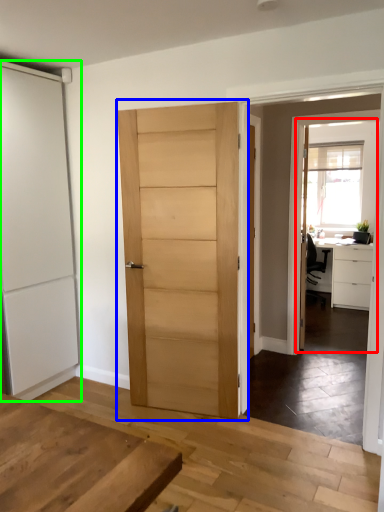
Question: Based on their relative distances, which object is farther from screen door (highlighted by a red box)? Choose from door (highlighted by a blue box) and door (highlighted by a green box).

Choices:
 (A) door
 (B) door

Answer: (B)